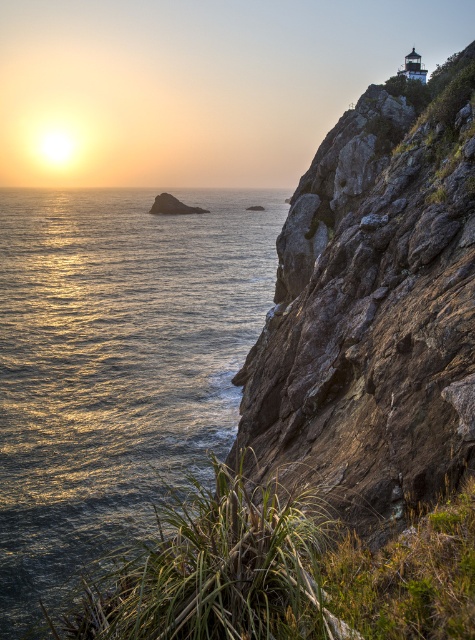
Who is more distant from viewer, (x=92, y=220) or (x=434, y=152)?

The point (x=92, y=220) is behind.

Locate an element on the screen. This screenshot has height=640, width=475. shiny metallic water at left is located at coordinates (115, 364).

Find the location of a particular element. The image size is (475, 640). shiny metallic water at left is located at coordinates (115, 364).